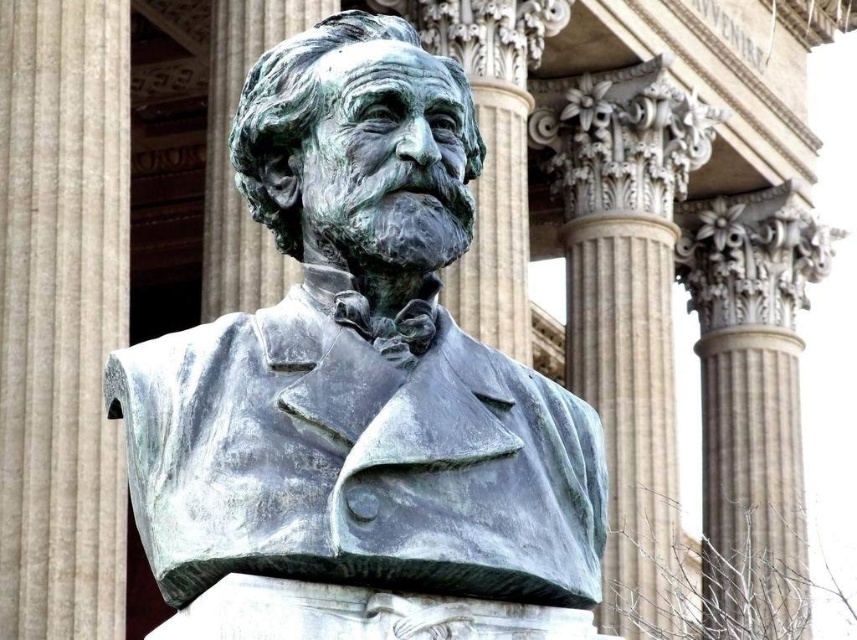
Question: Where is green patina bust at center located in relation to green patina stone bust at center in the image?

Choices:
 (A) right
 (B) left

Answer: (A)

Question: Which point is closer to the camera taking this photo?

Choices:
 (A) (217, 131)
 (B) (187, 337)

Answer: (B)

Question: Which object appears closest to the camera in this image?

Choices:
 (A) smooth stone column at center
 (B) green patina stone pillar at center

Answer: (A)

Question: From the image, what is the correct spatial relationship of green patina bust at center in relation to smooth stone column at center?

Choices:
 (A) right
 (B) left

Answer: (B)

Question: Estimate the real-world distances between objects in this image. Which object is farther from the green patina bust at center?

Choices:
 (A) smooth stone column at center
 (B) green patina stone bust at center

Answer: (B)

Question: Can you confirm if green patina bust at center is bigger than smooth stone column at center?

Choices:
 (A) yes
 (B) no

Answer: (B)